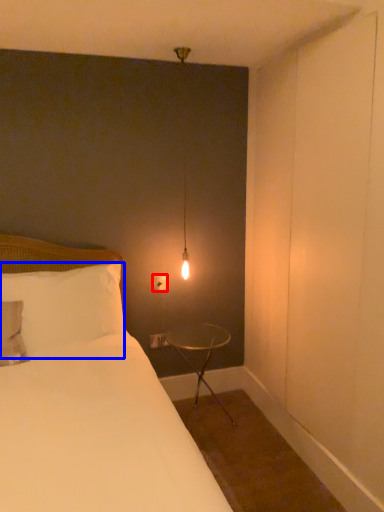
Question: Which point is further to the camera, electric outlet (highlighted by a red box) or pillow (highlighted by a blue box)?

Choices:
 (A) electric outlet
 (B) pillow

Answer: (A)